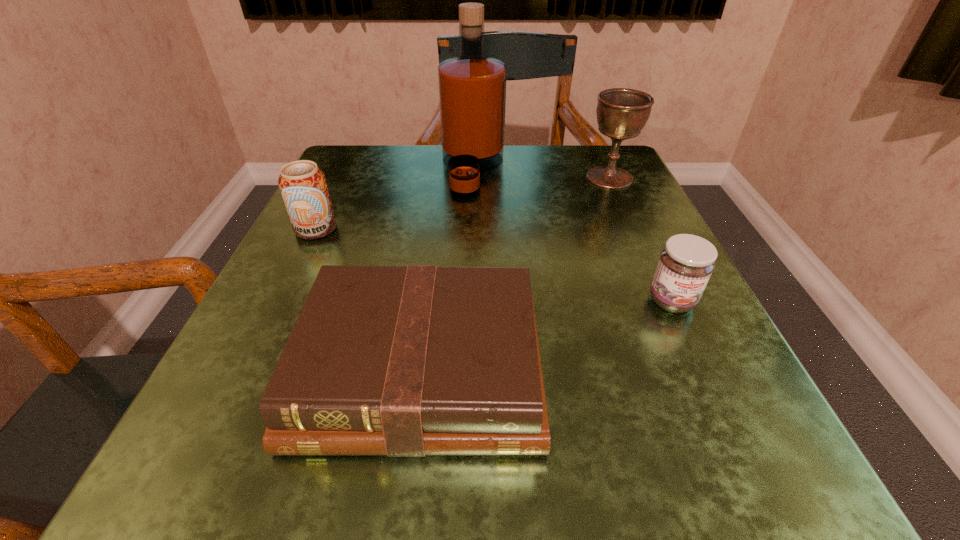
This screenshot has height=540, width=960. What are the coordinates of `liquor` in the screenshot? It's located at (472, 88).

Locate an element on the screen. the fourth shortest object is located at coordinates tap(621, 113).

Where is `the third tallest object`? The height and width of the screenshot is (540, 960). the third tallest object is located at coordinates (303, 186).

This screenshot has height=540, width=960. What are the coordinates of `beer can` in the screenshot? It's located at (303, 186).

At what (x,y) coordinates should I click in order to perform the action: click on the second shortest object. Please return your answer as a coordinate pair (x, y). The image size is (960, 540). Looking at the image, I should click on (686, 263).

Where is `the shortest object`? The image size is (960, 540). the shortest object is located at coordinates (406, 361).

You are a GUI agent. You are given a task and a screenshot of the screen. Output one action in this format:
    pyautogui.click(x=<x>, y=<y>)
    Task: Click on the vacant space located on the front label of the liquor
    
    Given the screenshot: What is the action you would take?
    pyautogui.click(x=611, y=170)

The height and width of the screenshot is (540, 960). I want to click on vacant space located 0.340m on the front of the chalice, so click(x=669, y=309).

This screenshot has height=540, width=960. What are the coordinates of `vacant space located 0.170m on the front of the beer can` in the screenshot? It's located at (276, 312).

Where is `vacant point located 0.120m on the front label of the jam`? vacant point located 0.120m on the front label of the jam is located at coordinates (713, 390).